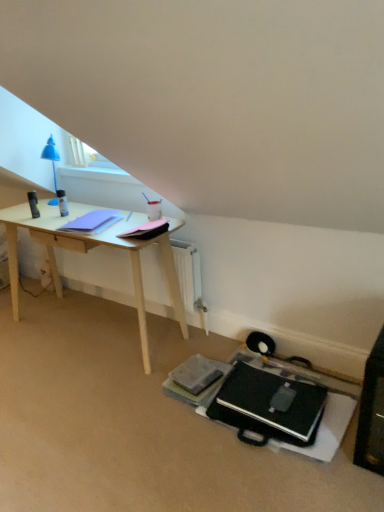
Measure the distance between point (72, 223) and camera.

Point (72, 223) and camera are 7.31 feet apart from each other.

What is the approximate height of matte purple notepad at left, the first notepad from the left?

matte purple notepad at left, the first notepad from the left, is 2.23 inches in height.

Image resolution: width=384 pixels, height=512 pixels. In order to click on pink matte notepad at center, which appears as the 1th notepad when viewed from the right in this screenshot , I will do `click(147, 230)`.

The height and width of the screenshot is (512, 384). What do you see at coordinates (273, 402) in the screenshot?
I see `black matte laptop at lower center` at bounding box center [273, 402].

Identify the location of black matte laptop at lower center. (273, 402).

Locate an element on the screen. matte purple notepad at left, the first notepad from the left is located at coordinates [x=93, y=221].

From a real-world perspective, who is located higher, black matte laptop at lower center or matte purple notepad at left, the first notepad from the left?

matte purple notepad at left, the first notepad from the left.

Considering the positions of points (243, 399) and (93, 226), is point (243, 399) closer to camera compared to point (93, 226)?

Yes, point (243, 399) is in front of point (93, 226).

Can you confirm if black matte laptop at lower center is wider than matte purple notepad at left, the 2th notepad viewed from the right?

Yes, black matte laptop at lower center is wider than matte purple notepad at left, the 2th notepad viewed from the right.

Can you confirm if black matte laptop at lower center is smaller than matte purple notepad at left, the first notepad from the left?

No.

This screenshot has width=384, height=512. In order to click on notepad on the left of pink matte notepad at center, which appears as the 1th notepad when viewed from the right in this screenshot , I will do `click(93, 221)`.

Is point (82, 231) more distant than point (133, 229)?

That is True.

Is matte purple notepad at left, the first notepad from the left, turned away from pink matte notepad at center, which appears as the 1th notepad when viewed from the right?

That's not correct — matte purple notepad at left, the first notepad from the left, is not looking away from pink matte notepad at center, which appears as the 1th notepad when viewed from the right.

From the image's perspective, which is below, pink matte notepad at center, the 2th notepad positioned from the left, or black matte laptop at lower center?

From the image's view, black matte laptop at lower center is below.

From a real-world perspective, which is physically below, pink matte notepad at center, the 2th notepad positioned from the left, or black matte laptop at lower center?

black matte laptop at lower center, from a real-world perspective.

Which of these two, pink matte notepad at center, the 2th notepad positioned from the left, or black matte laptop at lower center, is thinner?

With smaller width is pink matte notepad at center, the 2th notepad positioned from the left.

Are pink matte notepad at center, which appears as the 1th notepad when viewed from the right, and matte purple notepad at left, the first notepad from the left, making contact?

No, pink matte notepad at center, which appears as the 1th notepad when viewed from the right, is not in contact with matte purple notepad at left, the first notepad from the left.

Is pink matte notepad at center, the 2th notepad positioned from the left, to the left of matte purple notepad at left, the first notepad from the left, from the viewer's perspective?

In fact, pink matte notepad at center, the 2th notepad positioned from the left, is to the right of matte purple notepad at left, the first notepad from the left.

From a real-world perspective, relative to matte purple notepad at left, the 2th notepad viewed from the right, is pink matte notepad at center, the 2th notepad positioned from the left, vertically above or below?

pink matte notepad at center, the 2th notepad positioned from the left, is above matte purple notepad at left, the 2th notepad viewed from the right.

Is pink matte notepad at center, the 2th notepad positioned from the left, spatially inside matte purple notepad at left, the first notepad from the left, or outside of it?

pink matte notepad at center, the 2th notepad positioned from the left, is spatially situated outside matte purple notepad at left, the first notepad from the left.

Considering the relative sizes of matte purple notepad at left, the first notepad from the left, and black matte laptop at lower center in the image provided, is matte purple notepad at left, the first notepad from the left, bigger than black matte laptop at lower center?

Incorrect, matte purple notepad at left, the first notepad from the left, is not larger than black matte laptop at lower center.

From the image's perspective, is matte purple notepad at left, the 2th notepad viewed from the right, above or below black matte laptop at lower center?

matte purple notepad at left, the 2th notepad viewed from the right, is situated higher than black matte laptop at lower center in the image.

Which is in front, point (111, 222) or point (302, 393)?

The point (302, 393) is in front.

In the image, is matte purple notepad at left, the first notepad from the left, positioned in front of or behind black matte laptop at lower center?

In the image, matte purple notepad at left, the first notepad from the left, appears behind black matte laptop at lower center.

How different are the orientations of black matte laptop at lower center and pink matte notepad at center, which appears as the 1th notepad when viewed from the right, in degrees?

The facing directions of black matte laptop at lower center and pink matte notepad at center, which appears as the 1th notepad when viewed from the right, are 3.11 degrees apart.

Between black matte laptop at lower center and pink matte notepad at center, the 2th notepad positioned from the left, which one appears on the right side from the viewer's perspective?

black matte laptop at lower center is more to the right.

Considering their positions, is black matte laptop at lower center located in front of or behind pink matte notepad at center, which appears as the 1th notepad when viewed from the right?

Visually, black matte laptop at lower center is located in front of pink matte notepad at center, which appears as the 1th notepad when viewed from the right.

From a real-world perspective, is black matte laptop at lower center positioned over pink matte notepad at center, the 2th notepad positioned from the left, based on gravity?

No, from a real-world perspective, black matte laptop at lower center is not over pink matte notepad at center, the 2th notepad positioned from the left

The height and width of the screenshot is (512, 384). In order to click on the 2nd notepad counting from the left of the black matte laptop at lower center in this screenshot , I will do `click(93, 221)`.

Locate an element on the screen. This screenshot has height=512, width=384. notepad below the pink matte notepad at center, the 2th notepad positioned from the left (from a real-world perspective) is located at coordinates (93, 221).

Looking at the image, which one is located closer to black matte laptop at lower center, pink matte notepad at center, the 2th notepad positioned from the left, or matte purple notepad at left, the first notepad from the left?

pink matte notepad at center, the 2th notepad positioned from the left, lies closer to black matte laptop at lower center than the other object.

Considering their positions, is pink matte notepad at center, the 2th notepad positioned from the left, positioned closer to matte purple notepad at left, the 2th notepad viewed from the right, than black matte laptop at lower center?

Among the two, pink matte notepad at center, the 2th notepad positioned from the left, is located nearer to matte purple notepad at left, the 2th notepad viewed from the right.

Which object lies further to the anchor point pink matte notepad at center, which appears as the 1th notepad when viewed from the right, black matte laptop at lower center or matte purple notepad at left, the first notepad from the left?

Among the two, black matte laptop at lower center is located further to pink matte notepad at center, which appears as the 1th notepad when viewed from the right.

From the image, which object appears to be nearer to black matte laptop at lower center, matte purple notepad at left, the 2th notepad viewed from the right, or pink matte notepad at center, the 2th notepad positioned from the left?

pink matte notepad at center, the 2th notepad positioned from the left, is positioned closer to the anchor black matte laptop at lower center.

Looking at this image, from the image, which object appears to be nearer to pink matte notepad at center, which appears as the 1th notepad when viewed from the right, matte purple notepad at left, the first notepad from the left, or black matte laptop at lower center?

The object closer to pink matte notepad at center, which appears as the 1th notepad when viewed from the right, is matte purple notepad at left, the first notepad from the left.

When comparing their distances from matte purple notepad at left, the first notepad from the left, does black matte laptop at lower center or pink matte notepad at center, which appears as the 1th notepad when viewed from the right, seem closer?

The object closer to matte purple notepad at left, the first notepad from the left, is pink matte notepad at center, which appears as the 1th notepad when viewed from the right.

The width and height of the screenshot is (384, 512). Identify the location of notepad between matte purple notepad at left, the first notepad from the left, and black matte laptop at lower center, in the vertical direction. (147, 230).